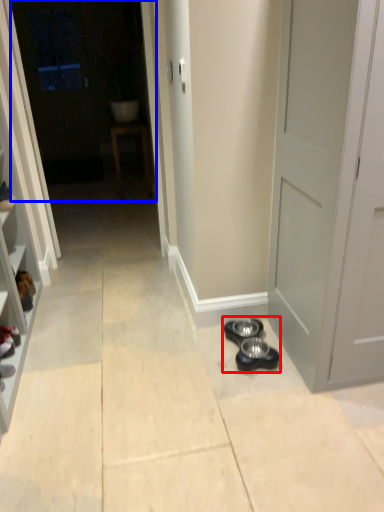
Question: Which of the following is the closest to the observer, shoe (highlighted by a red box) or glass door (highlighted by a blue box)?

Choices:
 (A) shoe
 (B) glass door

Answer: (A)